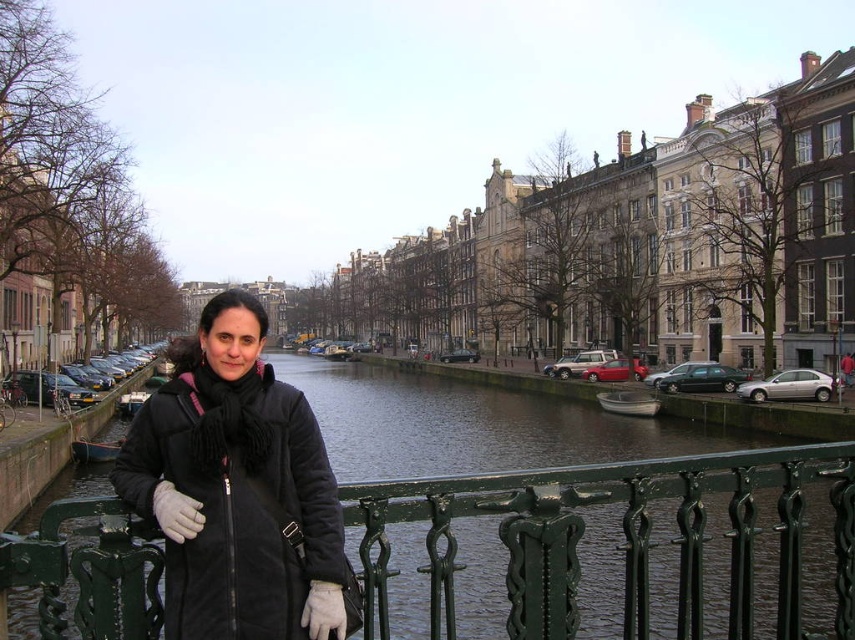
You are a photographer trying to capture the best shot of the green painted metal railing at center and the black suede coat at center. Since you want to emphasize the railing, which object should you focus on and why?

You should focus on the green painted metal railing at center because it has a larger size compared to the black suede coat at center, making it more prominent in the frame.

You are a photographer trying to capture the black suede coat at center and the green painted metal railing at center in the same frame. Which object is positioned lower in the image?

The green painted metal railing at center is positioned lower than the black suede coat at center in the image.